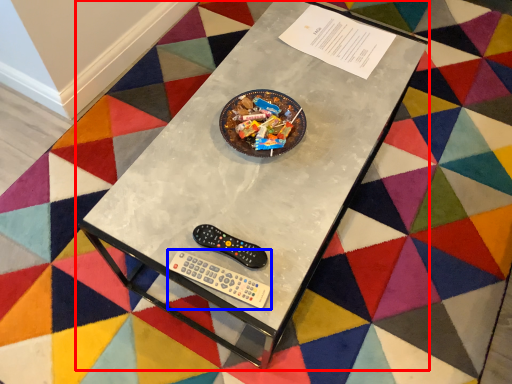
Question: Among these objects, which one is farthest to the camera, table (highlighted by a red box) or Wii controller (highlighted by a blue box)?

Choices:
 (A) table
 (B) Wii controller

Answer: (B)